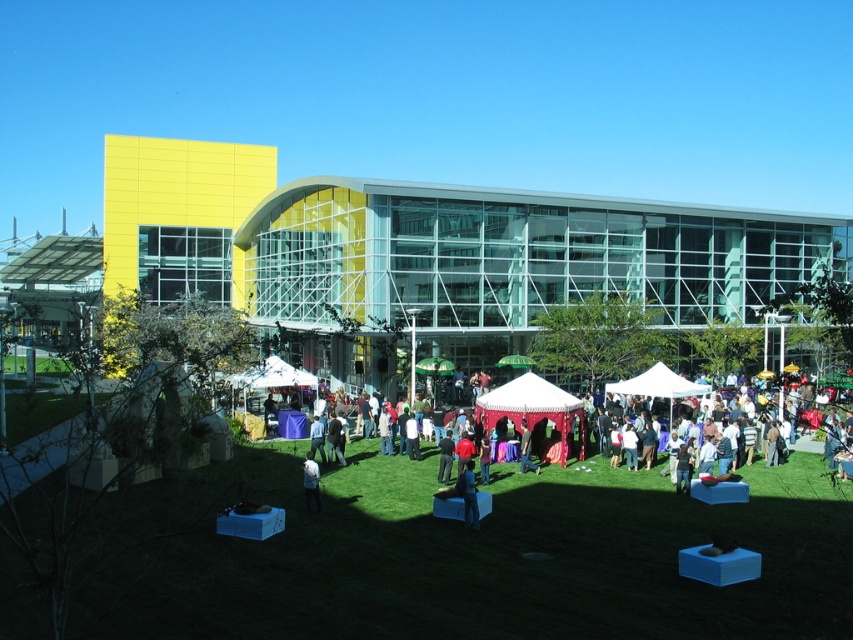
You are a photographer at the event and want to take a photo of both the red fabric tent at center and the dark blue shirt at center. Which object will appear taller in the photo?

The red fabric tent at center will appear taller in the photo because it has a greater height compared to the dark blue shirt at center.